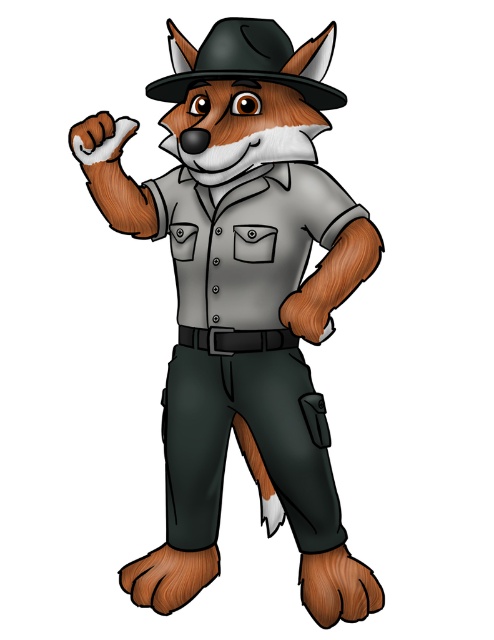
Is black matte fedora at upper center shorter than dark gray fabric pocket at lower center?

In fact, black matte fedora at upper center may be taller than dark gray fabric pocket at lower center.

Is point (268, 61) positioned before point (311, 401)?

Yes, it is in front of point (311, 401).

Find the location of a particular element. The height and width of the screenshot is (640, 494). black matte fedora at upper center is located at coordinates (249, 60).

Is gray matte uniform at center below dark gray fabric pocket at lower center?

No.

Identify the location of gray matte uniform at center. 246,349.

Between point (285, 484) and point (320, 428), which one is positioned in front?

Positioned in front is point (320, 428).

At what (x,y) coordinates should I click in order to perform the action: click on gray matte uniform at center. Please return your answer as a coordinate pair (x, y). This screenshot has width=494, height=640. Looking at the image, I should click on (246, 349).

Can you confirm if matte gray uniform at center is smaller than matte black pocket at center?

No, matte gray uniform at center is not smaller than matte black pocket at center.

Who is taller, matte gray uniform at center or matte black pocket at center?

With more height is matte gray uniform at center.

The width and height of the screenshot is (494, 640). I want to click on matte gray uniform at center, so click(x=243, y=300).